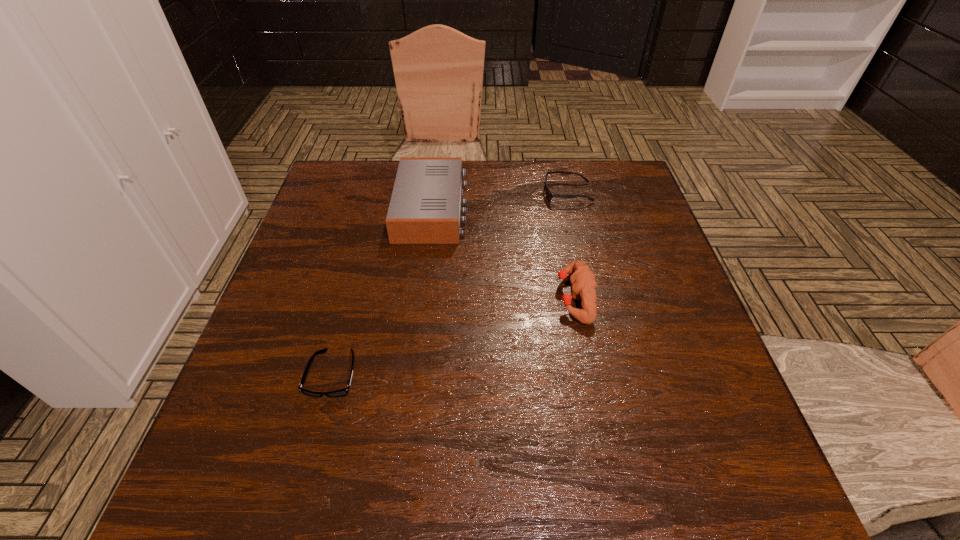
Locate an element on the screen. free location that satisfies the following two spatial constraints: 1. on the front-facing side of the taller sunglasses; 2. on the front-facing side of the nearer sunglasses is located at coordinates (611, 374).

Identify the location of free location that satisfies the following two spatial constraints: 1. on the front-facing side of the farther sunglasses; 2. on the front-facing side of the left sunglasses. This screenshot has height=540, width=960. (611, 374).